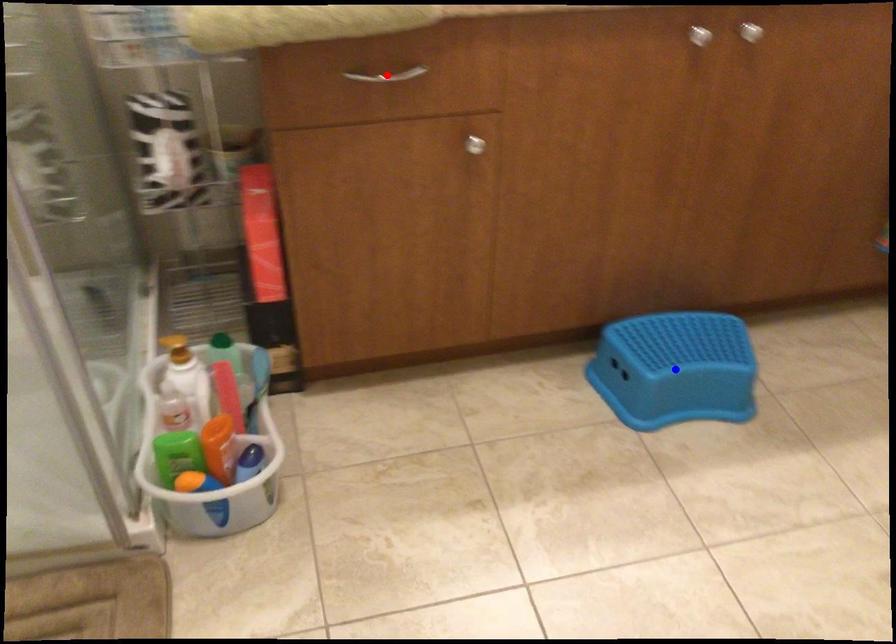
Question: Which of the two points in the image is closer to the camera?

Choices:
 (A) Blue point is closer.
 (B) Red point is closer.

Answer: (B)